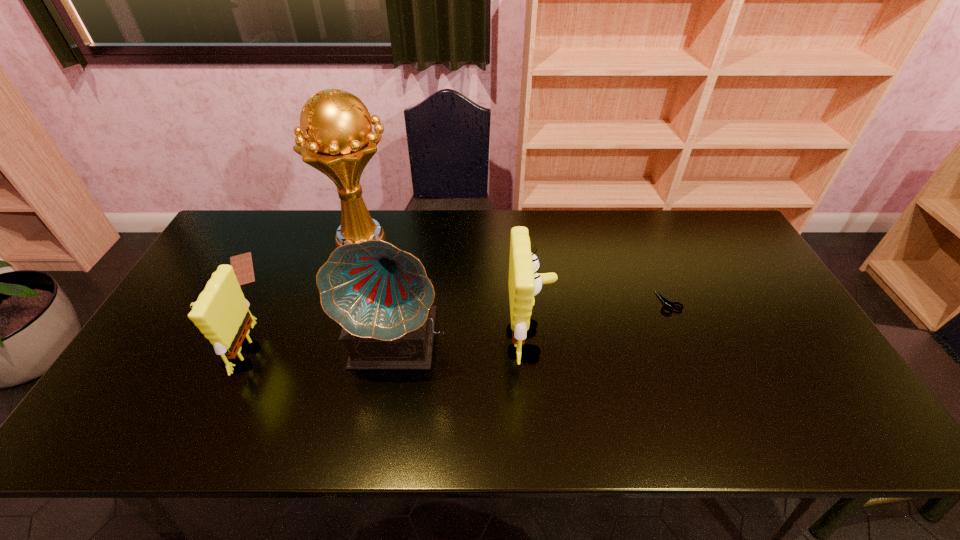
In order to click on the left sponge in this screenshot , I will do `click(221, 313)`.

Locate an element on the screen. The height and width of the screenshot is (540, 960). the shorter sponge is located at coordinates (221, 313).

Where is `the right sponge`? The height and width of the screenshot is (540, 960). the right sponge is located at coordinates click(x=524, y=282).

You are a GUI agent. You are given a task and a screenshot of the screen. Output one action in this format:
    pyautogui.click(x=<x>, y=<y>)
    Task: Click on the taller sponge
    This screenshot has width=960, height=540.
    Given the screenshot: What is the action you would take?
    pyautogui.click(x=524, y=282)

This screenshot has width=960, height=540. What are the coordinates of `trophy_cup` in the screenshot? It's located at (335, 136).

Where is `the leftmost object`? The image size is (960, 540). the leftmost object is located at coordinates (242, 264).

Locate an element on the screen. The height and width of the screenshot is (540, 960). chocolate bar is located at coordinates (242, 264).

Identify the location of record player. (381, 296).

The image size is (960, 540). Find the location of `the second shortest object`. the second shortest object is located at coordinates (666, 302).

Image resolution: width=960 pixels, height=540 pixels. I want to click on shears, so pos(666,302).